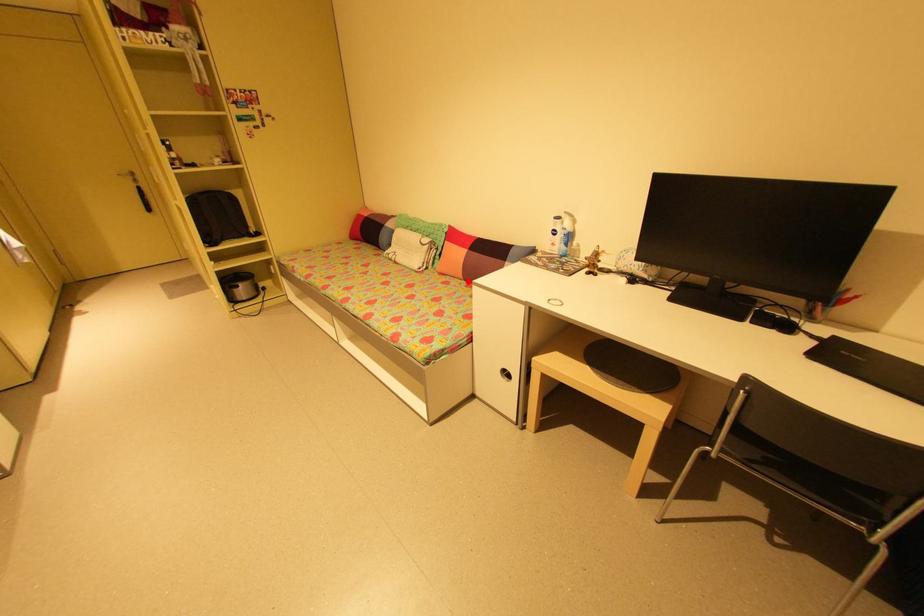
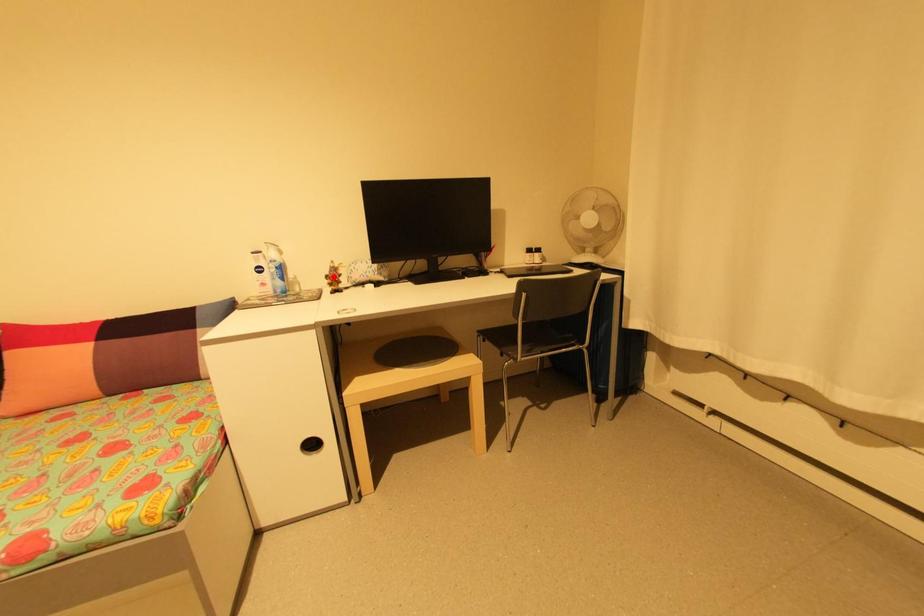
I am providing you with two images of the same scene from different viewpoints. A red point is marked on the first image and another point is marked on the second image. Is the marked point in image1 the same physical position as the marked point in image2?

No